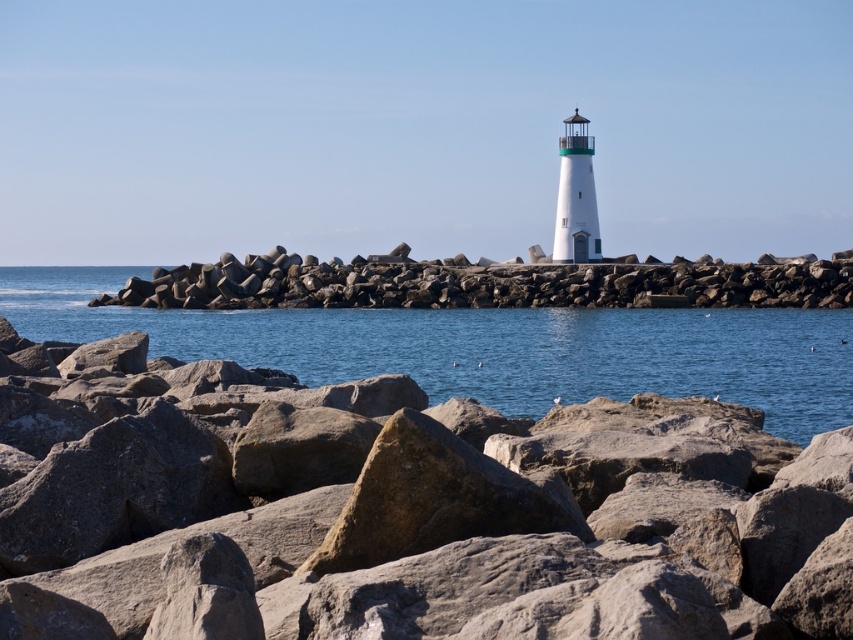
Which is in front, point (595, 323) or point (187, 305)?

Point (595, 323)

Does point (341, 355) come behind point (219, 273)?

No.

Does point (228, 332) come closer to viewer compared to point (227, 289)?

Yes, it is in front of point (227, 289).

Identify the location of blue water at center. (508, 349).

Does gray rock at center have a lesser height compared to blue water at center?

Yes.

Find the location of a particular element. gray rock at center is located at coordinates (403, 513).

Is gray rock at center above rockyroughrocks at center?

Actually, gray rock at center is below rockyroughrocks at center.

Does gray rock at center have a greater height compared to rockyroughrocks at center?

No, gray rock at center is not taller than rockyroughrocks at center.

Who is more forward, (281,401) or (448,291)?

Positioned in front is point (281,401).

Locate an element on the screen. This screenshot has height=640, width=853. gray rock at center is located at coordinates (403, 513).